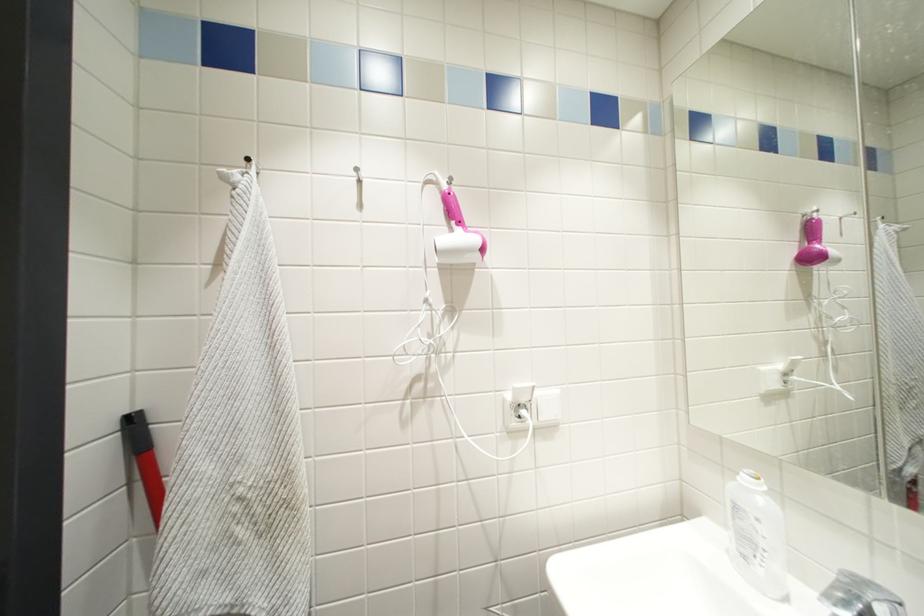
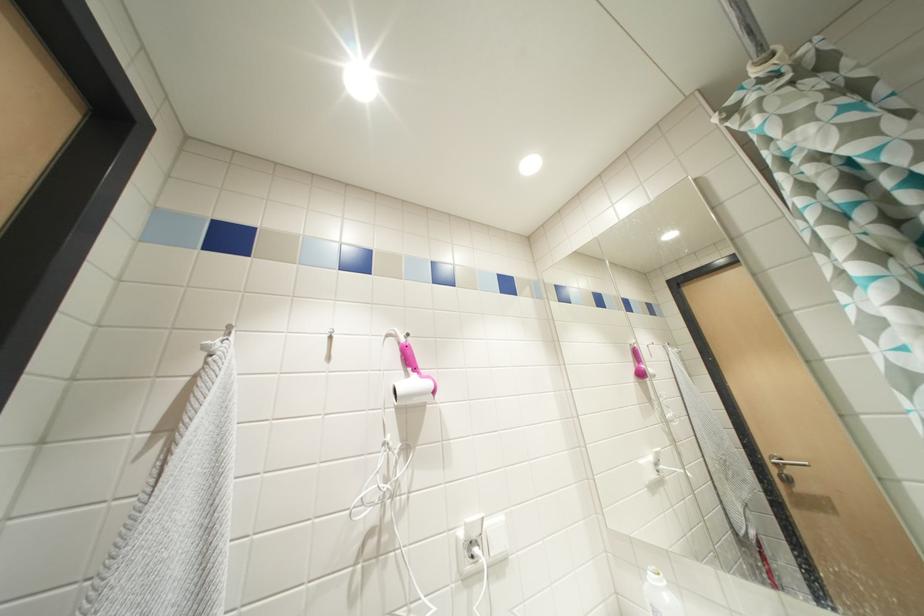
From the picture: The first image is from the beginning of the video and the second image is from the end. How did the camera likely rotate when shooting the video?

The camera's rotation is toward right-up.